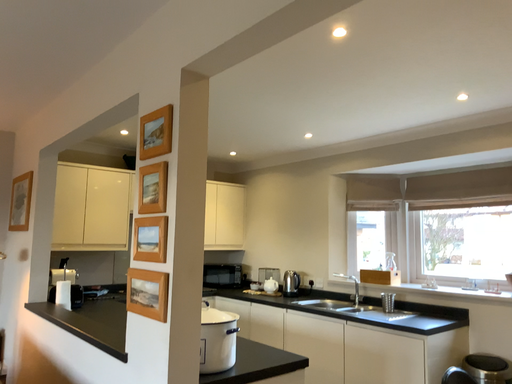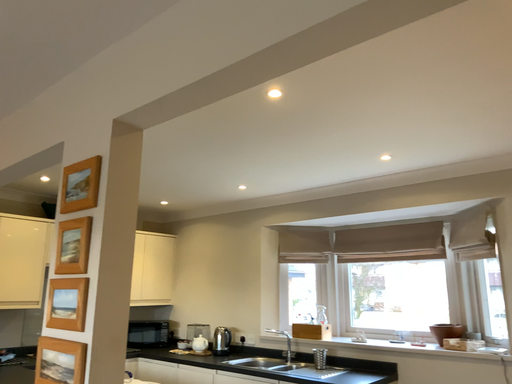
Question: Which way did the camera rotate in the video?

Choices:
 (A) rotated left
 (B) rotated right

Answer: (B)